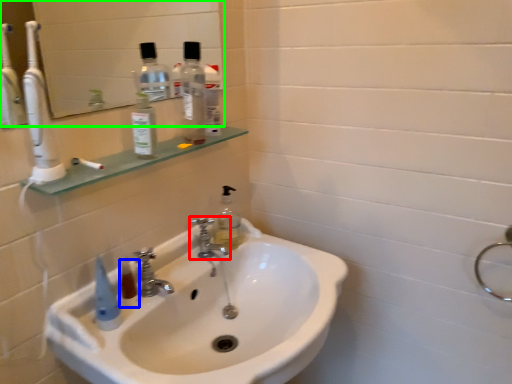
Question: Based on their relative distances, which object is nearer to tap (highlighted by a red box)? Choose from mouthwash (highlighted by a blue box) and mirror (highlighted by a green box).

Choices:
 (A) mouthwash
 (B) mirror

Answer: (A)